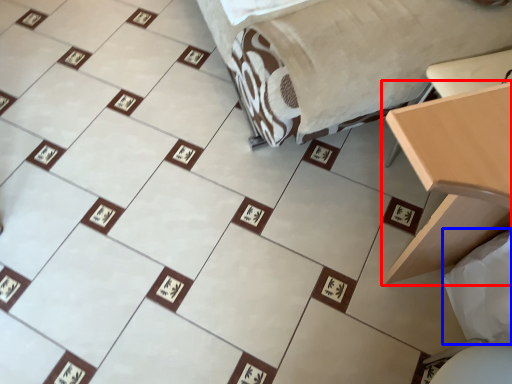
Question: Among these objects, which one is farthest to the camera, table (highlighted by a red box) or sheet (highlighted by a blue box)?

Choices:
 (A) table
 (B) sheet

Answer: (B)